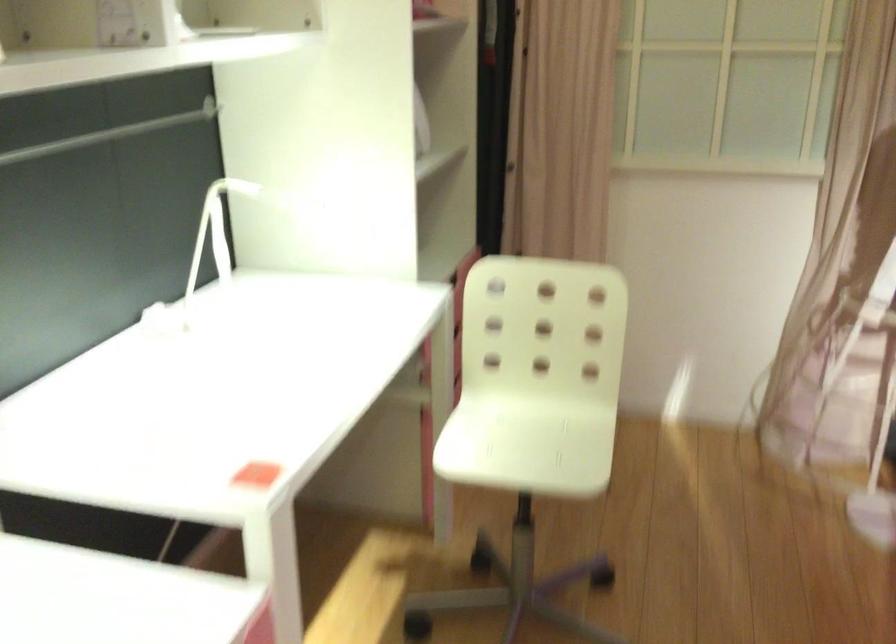
Where would you sit the white chair sitting surface? Please return your answer as a coordinate pair (x, y).

(495, 431)